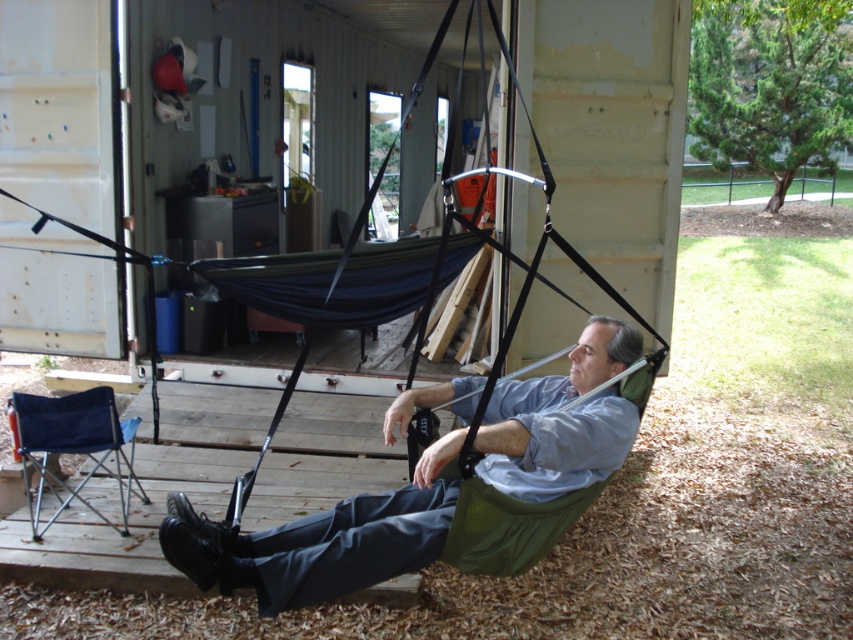
Is green fabric hammock at center behind blue fabric folding chair at lower left?

No, green fabric hammock at center is in front of blue fabric folding chair at lower left.

Is point (589, 326) positioned before point (113, 528)?

Yes, it is.

Where is `green fabric hammock at center`? The image size is (853, 640). green fabric hammock at center is located at coordinates (321, 540).